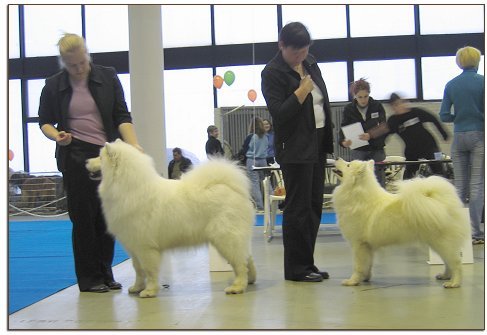
Locate an element on the screen. mats is located at coordinates (36, 247), (329, 217).